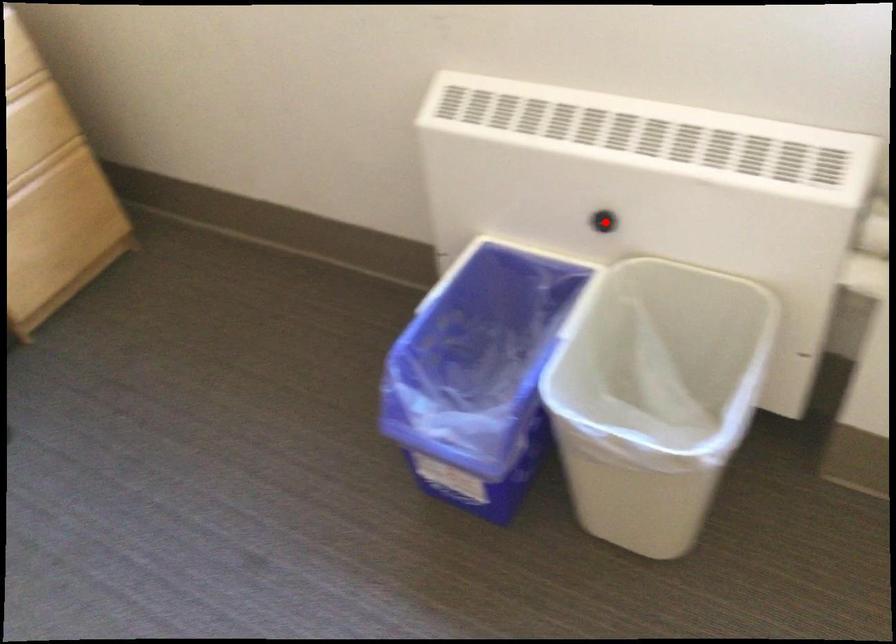
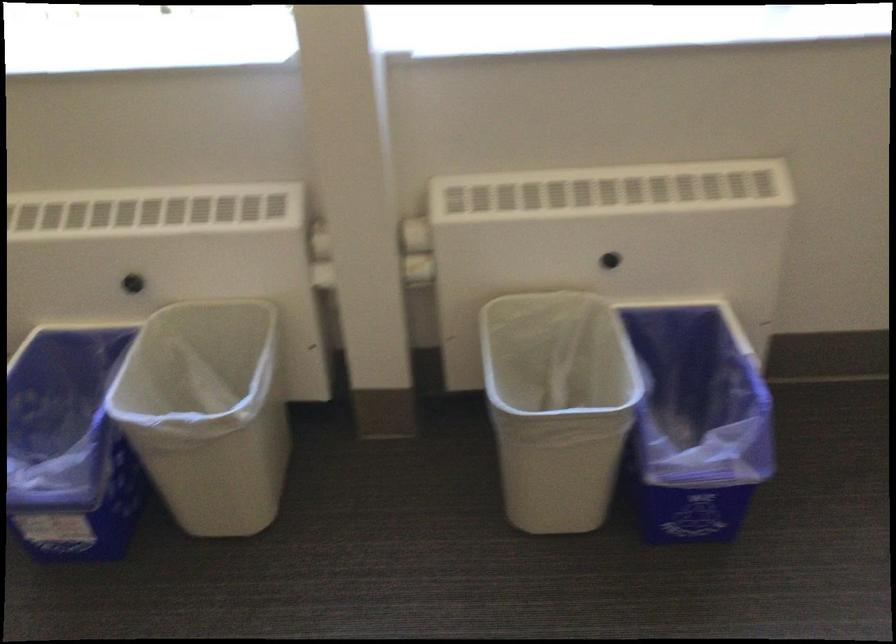
Question: I am providing you with two images of the same scene from different viewpoints. Given a red point in image1, look at the same physical point in image2. Is it:

Choices:
 (A) Closer to the viewpoint
 (B) Farther from the viewpoint

Answer: (B)